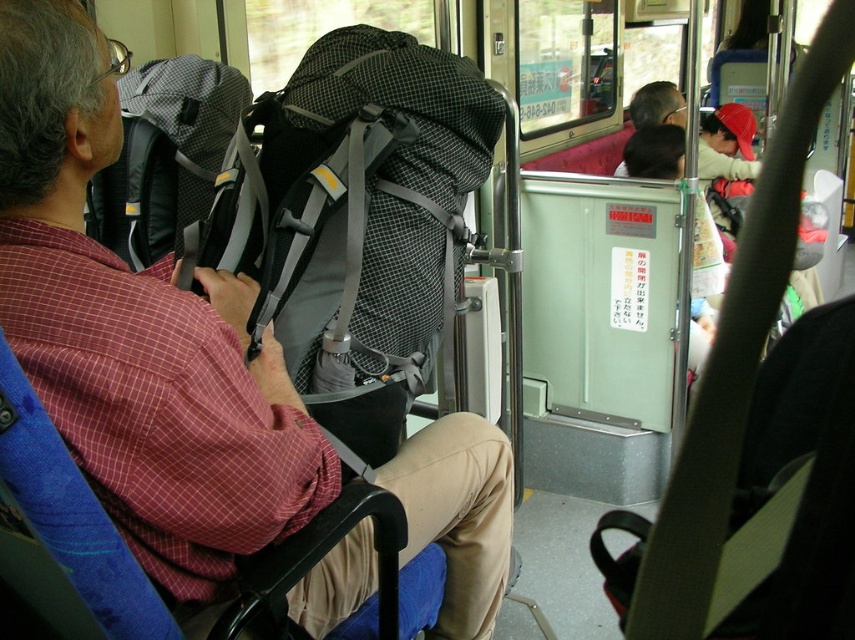
You are a passenger on a train and need to retrieve your phone from your backpack. You see a matte black backpack at center and a gray mesh backpack at left. Which backpack is located lower in the scene?

The matte black backpack at center is positioned under the gray mesh backpack at left, so it is lower in the scene.

You are standing at the center of the vehicle and want to reach the point marked at coordinate point (137,333). Is this point located on the matte black backpack at center?

Yes, the point (137,333) is on the matte black backpack at center.

You are a passenger on a train and need to place your matte black backpack at center in a safe location. According to the image, where should you place it so that it doesn not block the aisle?

The matte black backpack at center should be placed in the overhead compartment or under the seat to avoid blocking the aisle.